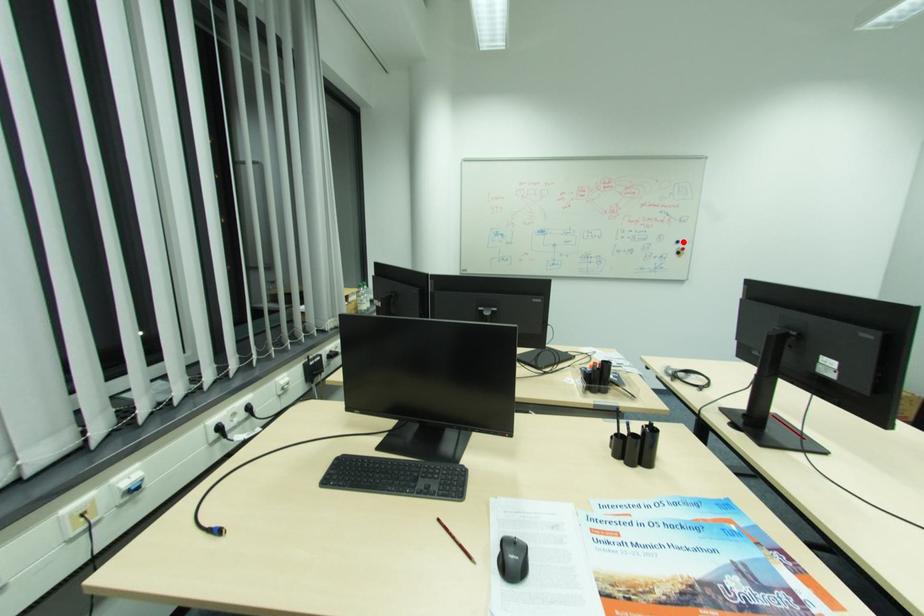
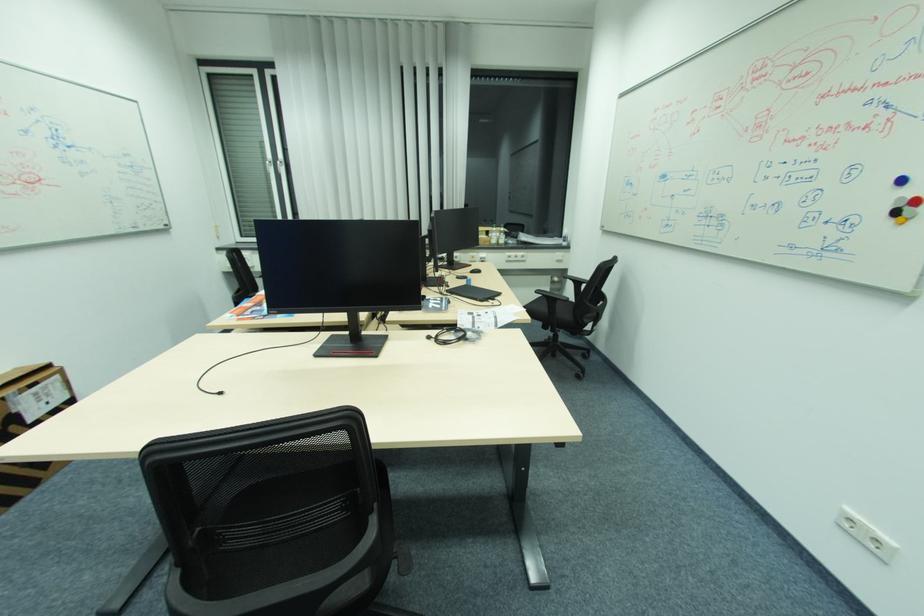
In the second image, find the point that corresponds to the highlighted location in the first image.

(908, 180)